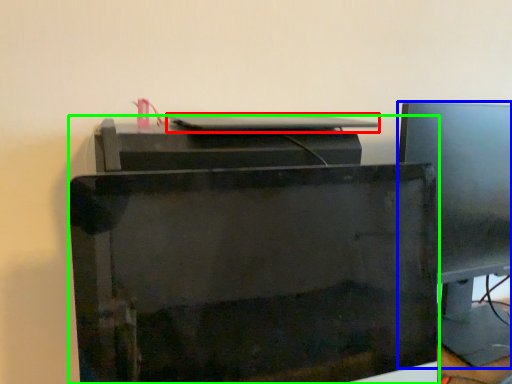
Question: Based on their relative distances, which object is farther from desktop (highlighted by a red box)? Choose from computer monitor (highlighted by a blue box) and printer (highlighted by a green box).

Choices:
 (A) computer monitor
 (B) printer

Answer: (A)